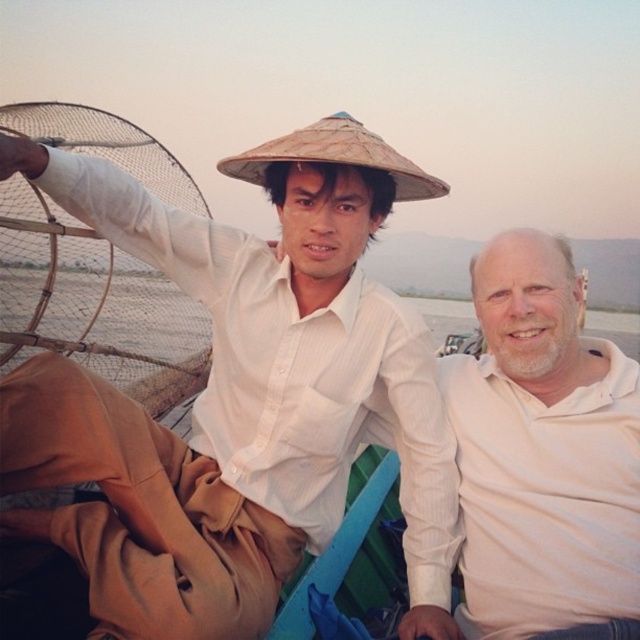
Consider the image. Who is lower down, white cotton shirt at center or brown mesh fishing net at left?

white cotton shirt at center is below.

How far apart are white cotton shirt at center and brown mesh fishing net at left?

8.68 feet

Who is more forward, (611, 579) or (104, 259)?

Point (611, 579) is in front.

Image resolution: width=640 pixels, height=640 pixels. I want to click on white cotton shirt at center, so click(x=541, y=451).

Is white cotton shirt at center to the left of brown straw hat at upper center from the viewer's perspective?

Incorrect, white cotton shirt at center is not on the left side of brown straw hat at upper center.

Which is behind, point (556, 486) or point (433, 182)?

Point (433, 182)

Find the location of a particular element. This screenshot has height=640, width=640. white cotton shirt at center is located at coordinates (541, 451).

Does matte straw hat at upper center have a smaller size compared to brown straw hat at upper center?

Actually, matte straw hat at upper center might be larger than brown straw hat at upper center.

This screenshot has height=640, width=640. Describe the element at coordinates (240, 397) in the screenshot. I see `matte straw hat at upper center` at that location.

Where is `matte straw hat at upper center`? The width and height of the screenshot is (640, 640). matte straw hat at upper center is located at coordinates [x=240, y=397].

Identify the location of matte straw hat at upper center. (240, 397).